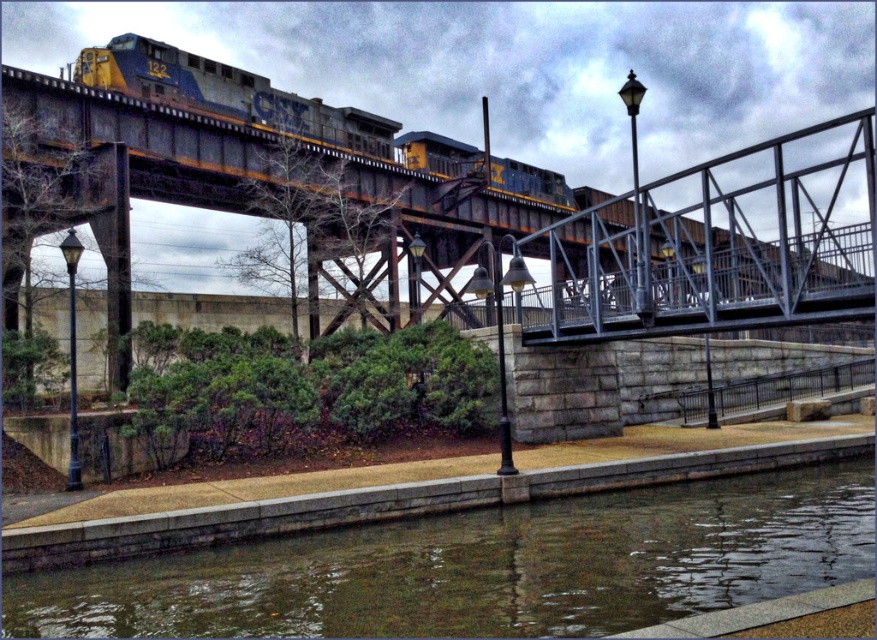
Question: Considering the real-world distances, which object is farthest from the rusty metal train at upper center?

Choices:
 (A) rusty metal bridge at upper center
 (B) smooth concrete river at lower center

Answer: (B)

Question: Does rusty metal bridge at upper center appear under rusty metal train at upper center?

Choices:
 (A) yes
 (B) no

Answer: (A)

Question: Can you confirm if rusty metal bridge at upper center is positioned to the left of smooth concrete river at lower center?

Choices:
 (A) no
 (B) yes

Answer: (A)

Question: Among these objects, which one is farthest from the camera?

Choices:
 (A) rusty metal bridge at upper center
 (B) rusty metal train at upper center
 (C) smooth concrete river at lower center

Answer: (B)

Question: Which of these objects is positioned closest to the rusty metal train at upper center?

Choices:
 (A) rusty metal bridge at upper center
 (B) smooth concrete river at lower center

Answer: (A)

Question: Does rusty metal bridge at upper center appear on the right side of smooth concrete river at lower center?

Choices:
 (A) yes
 (B) no

Answer: (A)